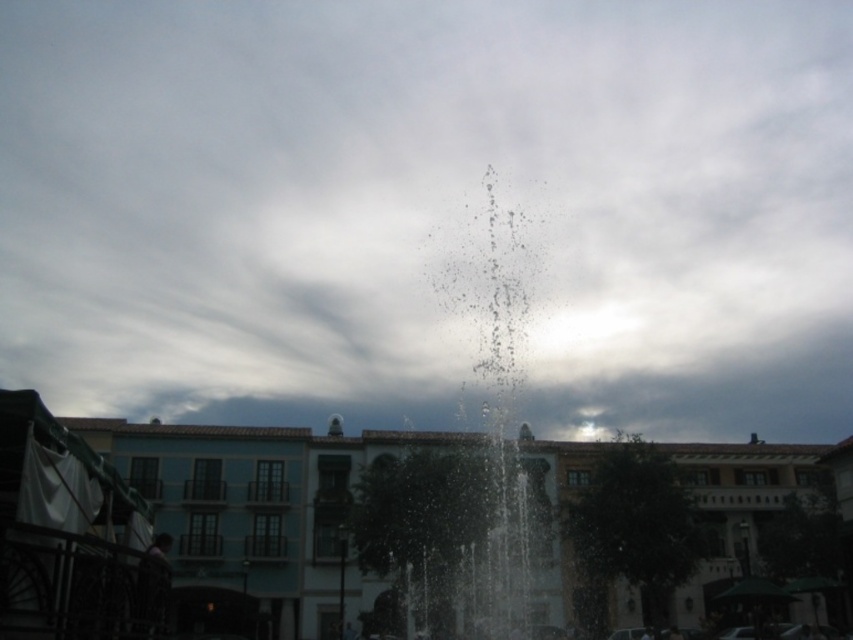
You are an artist trying to paint the scene. You notice the white fluffy cloud at center and the clear water at center. Which object should you draw first if you want to follow the rule of drawing taller objects before shorter ones?

Answer: The white fluffy cloud at center is much taller than the clear water at center, so you should draw the white fluffy cloud at center first.

You are standing in the outdoor scene with the central fountain. There is a point marked at coordinates point [335,605] that you need to reach. If your walking distance limit is 300 feet, will you be able to reach that point?

The point [335,605] is 332.13 feet away from the viewer, which exceeds the 300 feet walking limit. Therefore, you cannot reach that point within your limit.